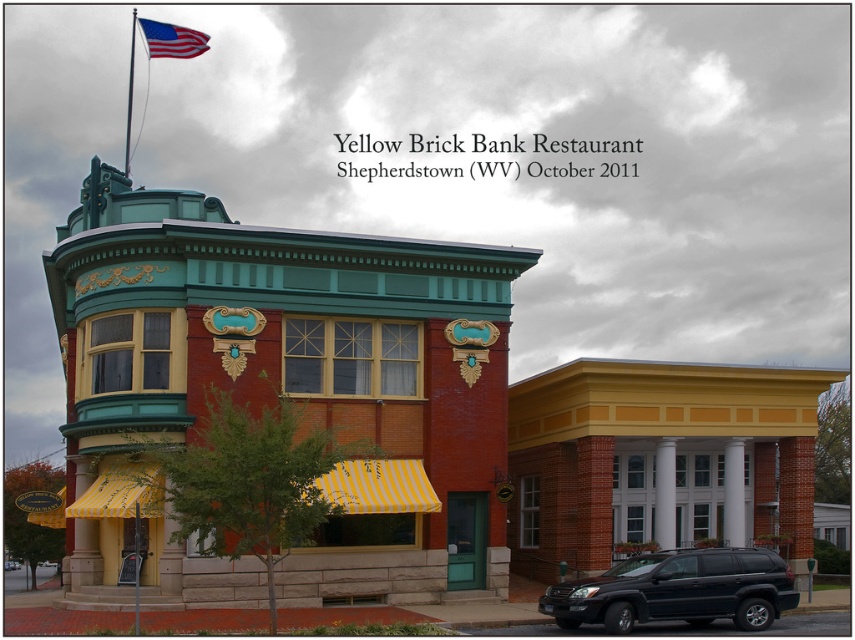
Question: Which object is the closest to the black matte suv at lower right?

Choices:
 (A) brick building at center
 (B) metallic flag pole at upper left
 (C) american flag at top left

Answer: (A)

Question: Which object is farther from the camera taking this photo?

Choices:
 (A) american flag at top left
 (B) metallic flag pole at upper left
 (C) brick building at center
 (D) black matte suv at lower right

Answer: (A)

Question: Estimate the real-world distances between objects in this image. Which object is farther from the metallic flag pole at upper left?

Choices:
 (A) black matte suv at lower right
 (B) american flag at top left

Answer: (A)

Question: Is brick building at center above black matte suv at lower right?

Choices:
 (A) yes
 (B) no

Answer: (A)

Question: Considering the relative positions of american flag at top left and metallic flag pole at upper left in the image provided, where is american flag at top left located with respect to metallic flag pole at upper left?

Choices:
 (A) left
 (B) right

Answer: (A)

Question: Does black matte suv at lower right have a smaller size compared to american flag at top left?

Choices:
 (A) yes
 (B) no

Answer: (A)